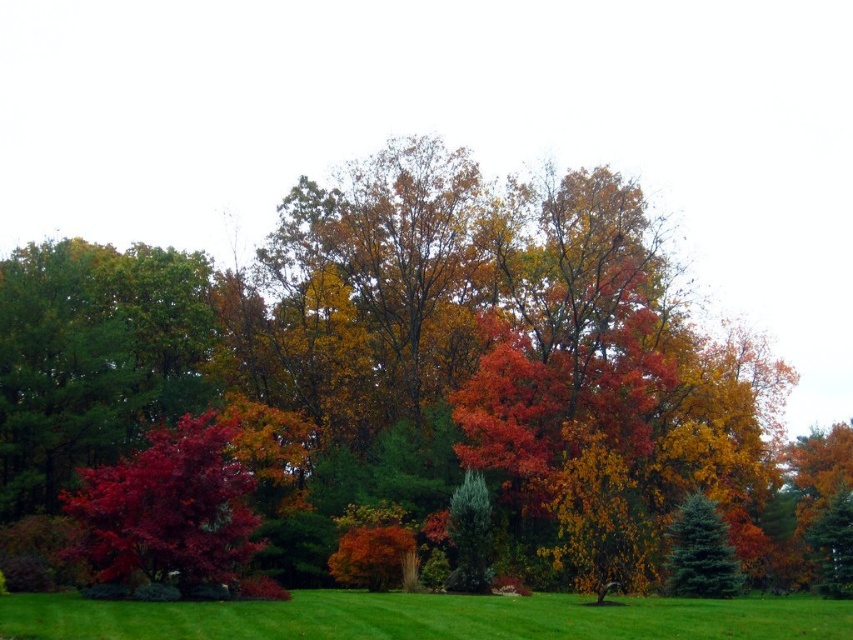
Question: Which point appears closest to the camera in this image?

Choices:
 (A) (460, 243)
 (B) (715, 531)
 (C) (86, 515)

Answer: (C)

Question: Which of the following is the farthest from the observer?

Choices:
 (A) (521, 321)
 (B) (691, 493)
 (C) (131, 580)

Answer: (A)

Question: Is glossy red tree at left positioned behind blue-green fir tree at center-right?

Choices:
 (A) no
 (B) yes

Answer: (A)

Question: Is shiny red maple at center positioned behind glossy red tree at left?

Choices:
 (A) no
 (B) yes

Answer: (B)

Question: Is glossy red tree at left thinner than blue-green fir tree at center-right?

Choices:
 (A) no
 (B) yes

Answer: (A)

Question: Which of the following is the farthest from the observer?

Choices:
 (A) (152, 496)
 (B) (244, 371)
 (C) (693, 524)

Answer: (B)